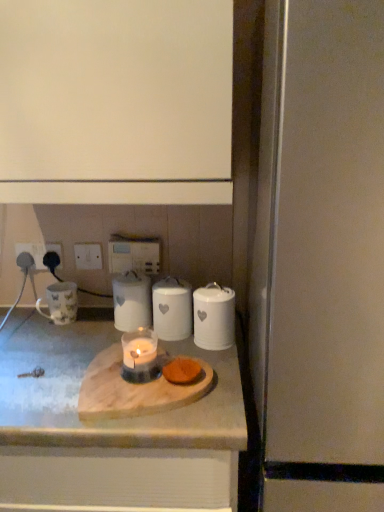
Question: Considering the relative positions of white ceramic jar at right, the fourth appliance in the left-to-right sequence, and white plastic electric outlet at lower left, which is the second electric outlet from right to left, in the image provided, is white ceramic jar at right, the fourth appliance in the left-to-right sequence, to the left of white plastic electric outlet at lower left, which is the second electric outlet from right to left, from the viewer's perspective?

Choices:
 (A) no
 (B) yes

Answer: (A)

Question: Is white ceramic jar at right, the second appliance when ordered from right to left, oriented away from white plastic electric outlet at lower left, positioned as the 2th electric outlet in left-to-right order?

Choices:
 (A) yes
 (B) no

Answer: (B)

Question: Is white ceramic jar at right, the second appliance when ordered from right to left, in front of white plastic electric outlet at lower left, which is the second electric outlet from right to left?

Choices:
 (A) no
 (B) yes

Answer: (B)

Question: Can you confirm if white ceramic jar at right, the fourth appliance in the left-to-right sequence, is thinner than white plastic electric outlet at lower left, which is the second electric outlet from right to left?

Choices:
 (A) no
 (B) yes

Answer: (A)

Question: Can you confirm if white ceramic jar at right, the second appliance when ordered from right to left, is smaller than white plastic electric outlet at lower left, positioned as the 2th electric outlet in left-to-right order?

Choices:
 (A) yes
 (B) no

Answer: (B)

Question: From the image's perspective, would you say white ceramic jar at right, the fourth appliance in the left-to-right sequence, is positioned over white plastic electric outlet at lower left, positioned as the 2th electric outlet in left-to-right order?

Choices:
 (A) no
 (B) yes

Answer: (A)

Question: Does white ceramic candle at center, which is the 2th appliance in left-to-right order, have a lesser width compared to orange sponge at center?

Choices:
 (A) yes
 (B) no

Answer: (B)

Question: Can you confirm if white ceramic candle at center, which appears as the 4th appliance when viewed from the right, is taller than orange sponge at center?

Choices:
 (A) no
 (B) yes

Answer: (B)

Question: Does white ceramic candle at center, which is the 2th appliance in left-to-right order, appear on the right side of orange sponge at center?

Choices:
 (A) no
 (B) yes

Answer: (A)

Question: Can you confirm if white ceramic candle at center, which is the 2th appliance in left-to-right order, is shorter than orange sponge at center?

Choices:
 (A) no
 (B) yes

Answer: (A)

Question: Is orange sponge at center at the back of white ceramic candle at center, which is the 2th appliance in left-to-right order?

Choices:
 (A) yes
 (B) no

Answer: (B)

Question: Can you see white ceramic candle at center, which appears as the 4th appliance when viewed from the right, touching orange sponge at center?

Choices:
 (A) no
 (B) yes

Answer: (A)

Question: Can you confirm if white ceramic candle at center, which is the 2th appliance in left-to-right order, is taller than white matte cabinet at upper center?

Choices:
 (A) no
 (B) yes

Answer: (A)